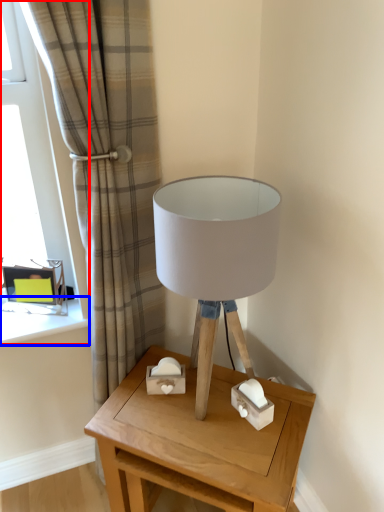
Question: Which object is further to the camera taking this photo, window (highlighted by a red box) or window sill (highlighted by a blue box)?

Choices:
 (A) window
 (B) window sill

Answer: (B)